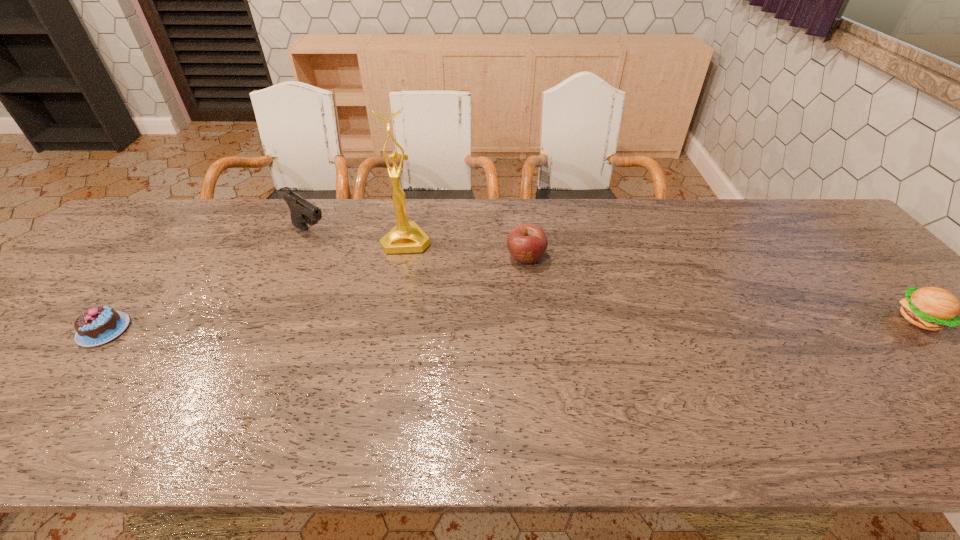
The image size is (960, 540). Identify the location of object present at the left edge. (98, 325).

In the image, there is a desktop. Identify the location of vacant space at the far edge. This screenshot has height=540, width=960. (728, 208).

You are a GUI agent. You are given a task and a screenshot of the screen. Output one action in this format:
    pyautogui.click(x=<x>, y=<y>)
    Task: Click on the free space at the near edge of the desktop
    The height and width of the screenshot is (540, 960).
    Given the screenshot: What is the action you would take?
    pyautogui.click(x=778, y=384)

In the image, there is a desktop. Where is `vacant space at the left edge`? Image resolution: width=960 pixels, height=540 pixels. vacant space at the left edge is located at coordinates (107, 272).

Find the location of `free spot at the far left corner of the desktop`. free spot at the far left corner of the desktop is located at coordinates (147, 244).

Identify the location of vacant space at the far right corner of the desktop. (790, 200).

You are a GUI agent. You are given a task and a screenshot of the screen. Output one action in this format:
    pyautogui.click(x=<x>, y=<y>)
    Task: Click on the free space between the award and the leftmost object
    
    Given the screenshot: What is the action you would take?
    pyautogui.click(x=255, y=285)

Where is `free space that is in between the third object from left to right and the second object from left to right`? free space that is in between the third object from left to right and the second object from left to right is located at coordinates (359, 237).

I want to click on vacant point located between the leftmost object and the fourth object from left to right, so click(315, 294).

Identify the location of vacant point located between the fourth object from left to right and the award. The width and height of the screenshot is (960, 540). (467, 249).